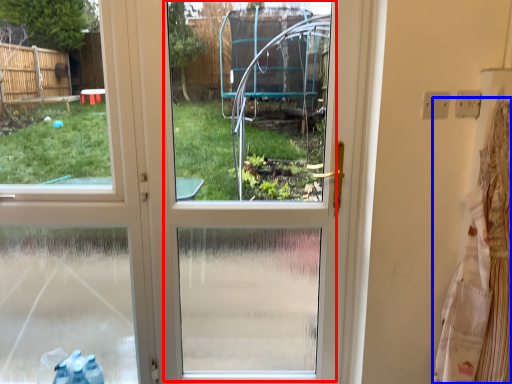
Question: Which object is closer to the camera taking this photo, screen door (highlighted by a red box) or laundry (highlighted by a blue box)?

Choices:
 (A) screen door
 (B) laundry

Answer: (B)